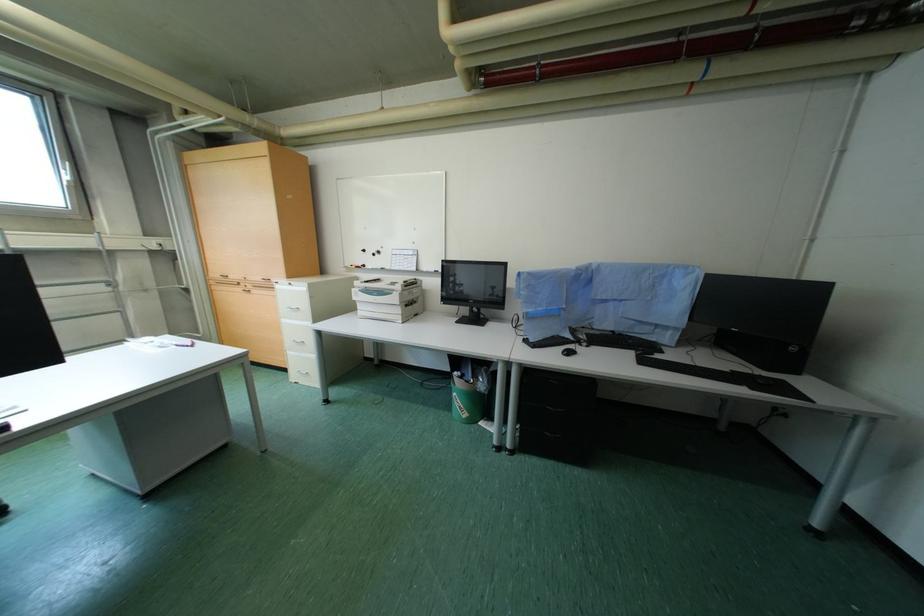
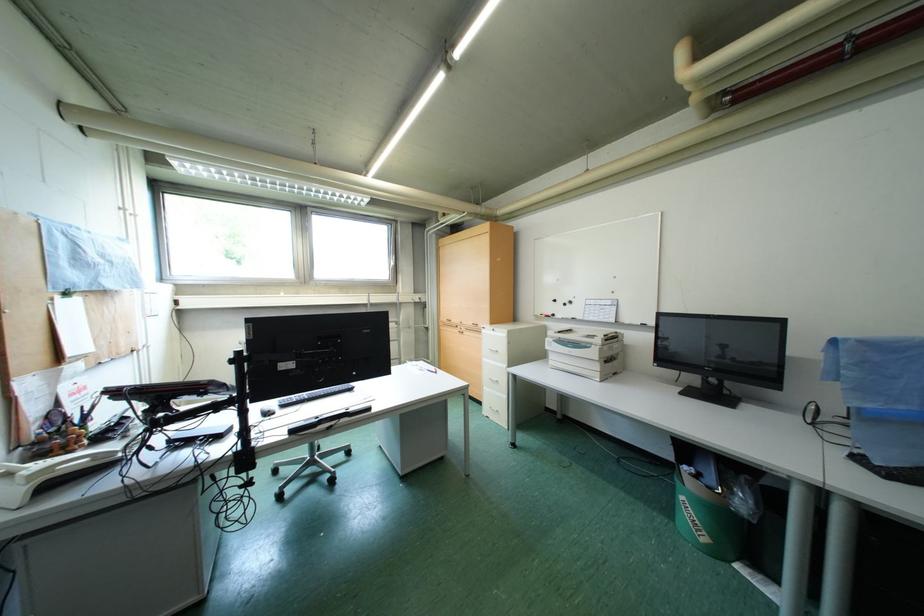
Question: The camera is either moving clockwise (left) or counter-clockwise (right) around the object. The first image is from the beginning of the video and the second image is from the end. Is the camera moving left or right when shooting the video?

Choices:
 (A) Left
 (B) Right

Answer: (B)